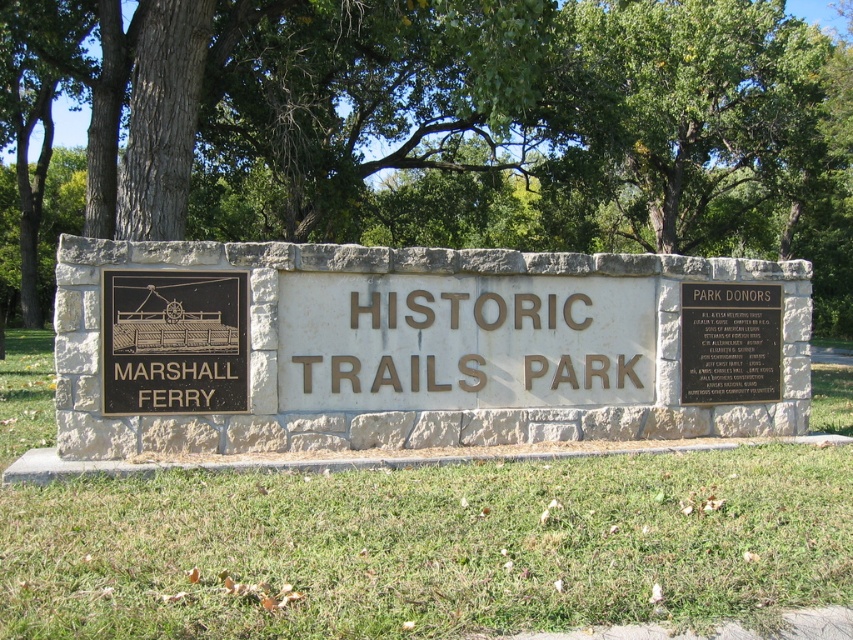
Question: Based on their relative distances, which object is farther from the black polished metal plaque at upper right?

Choices:
 (A) black polished metal plaque at center
 (B) green leafy tree at center
 (C) gold metallic sign at center

Answer: (B)

Question: Is green leafy tree at center in front of black polished metal plaque at center?

Choices:
 (A) no
 (B) yes

Answer: (A)

Question: Among these objects, which one is farthest from the camera?

Choices:
 (A) black polished metal plaque at center
 (B) gold metallic sign at center
 (C) green leafy tree at center
 (D) black polished metal plaque at upper right

Answer: (C)

Question: Does gold metallic sign at center lie in front of black polished metal plaque at center?

Choices:
 (A) yes
 (B) no

Answer: (B)

Question: Does green leafy tree at center appear under gold metallic sign at center?

Choices:
 (A) yes
 (B) no

Answer: (B)

Question: Which point appears closest to the camera in this image?

Choices:
 (A) (338, 346)
 (B) (775, 291)
 (C) (190, 353)
 (D) (570, 56)

Answer: (C)